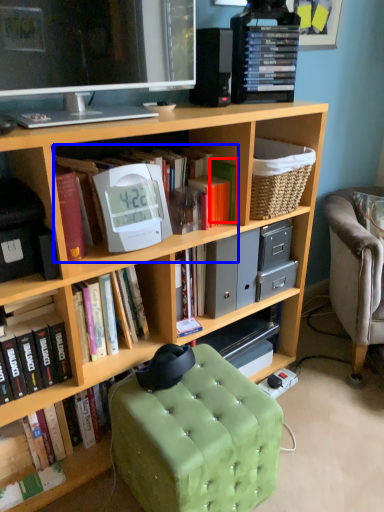
Question: Which of the following is the closest to the observer, paperback book (highlighted by a red box) or book (highlighted by a blue box)?

Choices:
 (A) paperback book
 (B) book

Answer: (B)